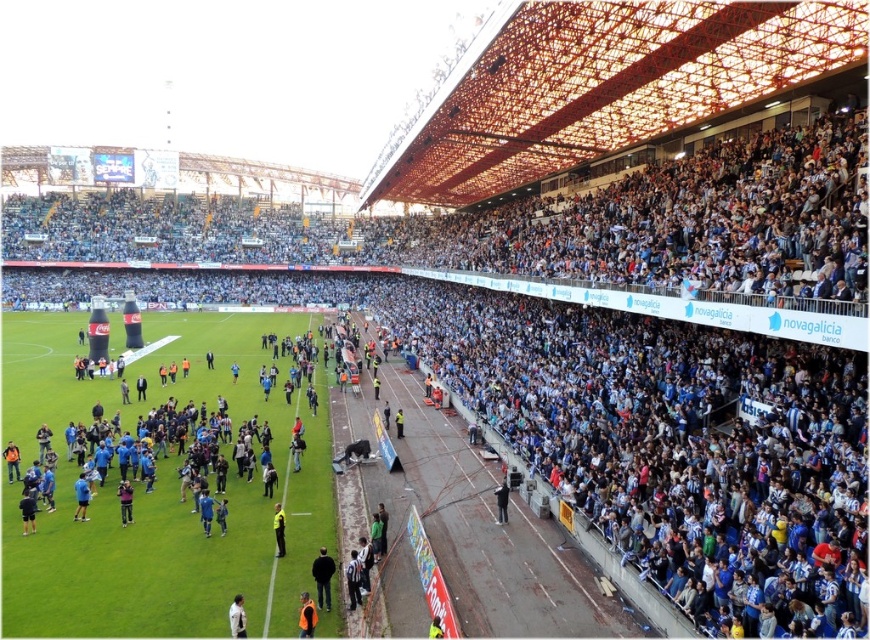
Between point (238, 627) and point (299, 448), which one is positioned in front?

Point (238, 627)

Is white matte shirt at lower left in front of light blue fabric jacket at center?

Yes.

This screenshot has width=870, height=640. What do you see at coordinates (238, 618) in the screenshot?
I see `white matte shirt at lower left` at bounding box center [238, 618].

In order to click on white matte shirt at lower left in this screenshot , I will do `click(238, 618)`.

Which is more to the left, black matte jacket at lower center or black fabric jacket at center?

black matte jacket at lower center is more to the left.

Does point (325, 579) come in front of point (506, 512)?

That is True.

Which is behind, point (312, 573) or point (497, 500)?

Positioned behind is point (497, 500).

The height and width of the screenshot is (640, 870). In order to click on black matte jacket at lower center in this screenshot , I will do `click(323, 577)`.

Which is in front, point (310, 604) or point (231, 632)?

Point (231, 632) is in front.

What do you see at coordinates (306, 616) in the screenshot?
I see `reflective yellow vest at lower center` at bounding box center [306, 616].

Locate an element on the screen. reflective yellow vest at lower center is located at coordinates (306, 616).